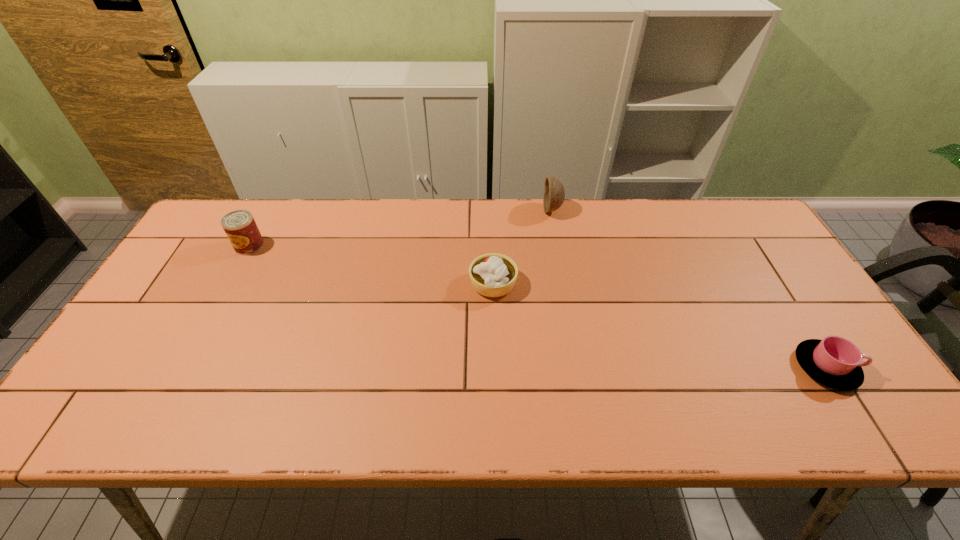
The image size is (960, 540). I want to click on free spot located 0.290m on the left of the second object from left to right, so click(366, 284).

Locate an element on the screen. bowl at the far edge is located at coordinates coord(554,193).

Where is `can at the far edge`? This screenshot has width=960, height=540. can at the far edge is located at coordinates (240, 227).

Find the location of `object that is at the left edge`. object that is at the left edge is located at coordinates (240, 227).

Image resolution: width=960 pixels, height=540 pixels. In order to click on object situated at the right edge in this screenshot , I will do `click(835, 362)`.

The image size is (960, 540). Identify the location of object present at the far left corner. (240, 227).

I want to click on vacant area at the far edge of the desktop, so click(x=279, y=224).

At what (x,y) coordinates should I click in order to perform the action: click on free spot at the near edge of the desktop. Please return your answer as a coordinate pair (x, y). This screenshot has height=540, width=960. Looking at the image, I should click on (201, 412).

This screenshot has width=960, height=540. Identify the location of free region at the left edge of the desktop. (183, 275).

What are the coordinates of `free region at the far left corner of the desktop` in the screenshot? It's located at (215, 230).